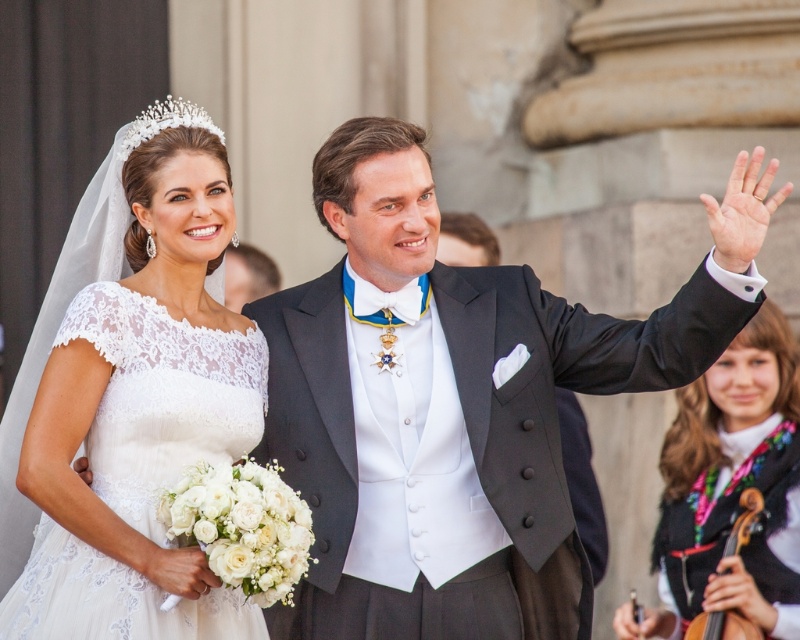
Is point (222, 413) positioned before point (733, 540)?

That is True.

Is white lace dress at left taller than wooden violin at lower right?

Yes.

The height and width of the screenshot is (640, 800). I want to click on white lace dress at left, so click(162, 397).

Which is above, shiny black suit at center or white lace dress at lower right?

Positioned higher is shiny black suit at center.

Can you confirm if shiny black suit at center is taller than white lace dress at lower right?

Yes, shiny black suit at center is taller than white lace dress at lower right.

Is point (730, 244) positioned after point (704, 417)?

That is False.

Locate an element on the screen. shiny black suit at center is located at coordinates (458, 403).

Does white lace dress at lower right have a larger size compared to wooden violin at lower right?

Yes, white lace dress at lower right is bigger than wooden violin at lower right.

Measure the distance between white lace dress at lower right and camera.

A distance of 60.69 meters exists between white lace dress at lower right and camera.

The width and height of the screenshot is (800, 640). Find the location of `white lace dress at lower right`. white lace dress at lower right is located at coordinates (729, 483).